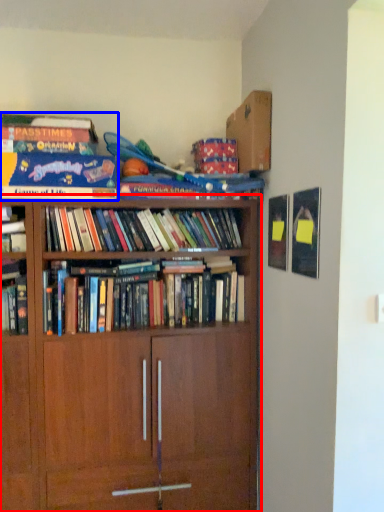
Question: Which object appears closest to the camera in this image, bookcase (highlighted by a red box) or book (highlighted by a blue box)?

Choices:
 (A) bookcase
 (B) book

Answer: (A)